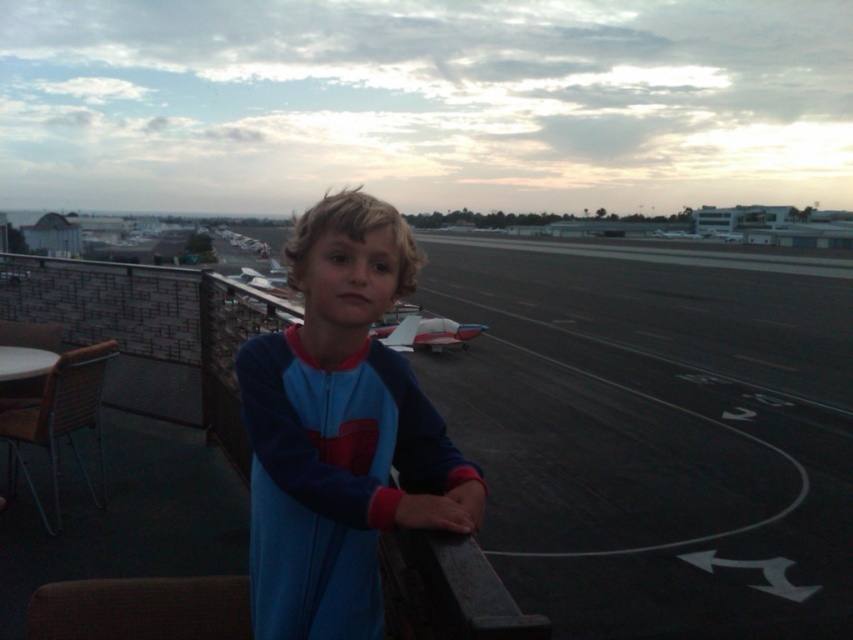
You are standing on the balcony and looking at two points marked on the railing. Which point is closer to you, point (x=509, y=518) or point (x=375, y=472)?

Point (x=509, y=518) is further to the viewer than point (x=375, y=472), so the closer point is point (x=375, y=472).